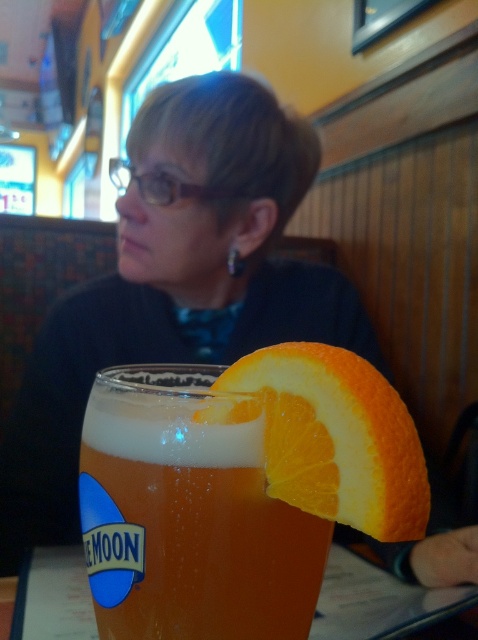
Question: Among these objects, which one is farthest from the camera?

Choices:
 (A) orangesmoothslice at right
 (B) translucent glass beer at center

Answer: (B)

Question: Can you confirm if translucent glass beer at center is wider than orangesmoothslice at right?

Choices:
 (A) no
 (B) yes

Answer: (B)

Question: Does translucent glass beer at center appear on the left side of orangesmoothslice at right?

Choices:
 (A) no
 (B) yes

Answer: (B)

Question: Is translucent glass beer at center thinner than orangesmoothslice at right?

Choices:
 (A) yes
 (B) no

Answer: (B)

Question: Which point is closer to the camera?

Choices:
 (A) translucent glass beer at center
 (B) orangesmoothslice at right

Answer: (B)

Question: Among these objects, which one is nearest to the camera?

Choices:
 (A) orangesmoothslice at right
 (B) translucent glass beer at center

Answer: (A)